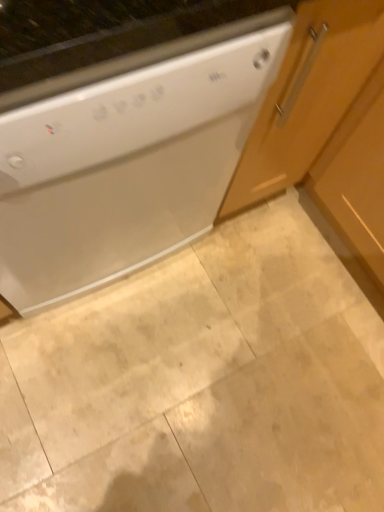
This screenshot has height=512, width=384. What do you see at coordinates (126, 157) in the screenshot? I see `white glossy dishwasher at upper left` at bounding box center [126, 157].

You are a GUI agent. You are given a task and a screenshot of the screen. Output one action in this format:
    pyautogui.click(x=<x>, y=<y>)
    Task: Click on the white glossy dishwasher at upper left
    This screenshot has width=384, height=512.
    Given the screenshot: What is the action you would take?
    pyautogui.click(x=126, y=157)

The width and height of the screenshot is (384, 512). I want to click on beige marble floor at center, so click(202, 383).

Which object is wider, beige marble floor at center or white glossy dishwasher at upper left?

With larger width is beige marble floor at center.

From a real-world perspective, does beige marble floor at center stand above white glossy dishwasher at upper left?

No, from a real-world perspective, beige marble floor at center is not on top of white glossy dishwasher at upper left.

Is beige marble floor at center with white glossy dishwasher at upper left?

No, beige marble floor at center is not touching white glossy dishwasher at upper left.

Looking at this image, in terms of size, does beige marble floor at center appear bigger or smaller than white glossy dishwasher at upper left?

In the image, beige marble floor at center appears to be smaller than white glossy dishwasher at upper left.

From the picture: Considering the relative positions of wooden cabinet at right and white glossy dishwasher at upper left in the image provided, is wooden cabinet at right to the left of white glossy dishwasher at upper left from the viewer's perspective?

In fact, wooden cabinet at right is to the right of white glossy dishwasher at upper left.

Considering the relative sizes of wooden cabinet at right and white glossy dishwasher at upper left in the image provided, is wooden cabinet at right shorter than white glossy dishwasher at upper left?

Indeed, wooden cabinet at right has a lesser height compared to white glossy dishwasher at upper left.

Looking at this image, could you tell me if wooden cabinet at right is turned towards white glossy dishwasher at upper left?

Yes, wooden cabinet at right is facing white glossy dishwasher at upper left.

Is wooden cabinet at right not close to white glossy dishwasher at upper left?

No, wooden cabinet at right is not far from white glossy dishwasher at upper left.

From a real-world perspective, who is located lower, wooden cabinet at right or beige marble floor at center?

beige marble floor at center, from a real-world perspective.

Based on the photo, is wooden cabinet at right taller or shorter than beige marble floor at center?

Clearly, wooden cabinet at right is taller compared to beige marble floor at center.

Is point (251, 181) positioned after point (7, 403)?

That is True.

In the image, is wooden cabinet at right positioned in front of or behind beige marble floor at center?

Clearly, wooden cabinet at right is in front of beige marble floor at center.

Which of these two, beige marble floor at center or wooden cabinet at right, stands shorter?

With less height is beige marble floor at center.

Between point (343, 308) and point (299, 99), which one is positioned in front?

Positioned in front is point (299, 99).

Which object is further away from the camera taking this photo, beige marble floor at center or wooden cabinet at right?

beige marble floor at center is behind.

Would you say beige marble floor at center is a long distance from wooden cabinet at right?

They are positioned close to each other.

Is white glossy dishwasher at upper left directly adjacent to beige marble floor at center?

There is a gap between white glossy dishwasher at upper left and beige marble floor at center.

Is white glossy dishwasher at upper left taller or shorter than beige marble floor at center?

Considering their sizes, white glossy dishwasher at upper left has more height than beige marble floor at center.

Which is behind, white glossy dishwasher at upper left or beige marble floor at center?

beige marble floor at center is behind.

Does point (216, 162) come closer to viewer compared to point (88, 392)?

Yes, point (216, 162) is closer to viewer.

Is white glossy dishwasher at upper left far away from wooden cabinet at right?

No, white glossy dishwasher at upper left is in close proximity to wooden cabinet at right.

Is white glossy dishwasher at upper left facing away from wooden cabinet at right?

No, white glossy dishwasher at upper left's orientation is not away from wooden cabinet at right.

Is point (204, 201) closer to camera compared to point (325, 136)?

Yes, point (204, 201) is in front of point (325, 136).

Is white glossy dishwasher at upper left not inside wooden cabinet at right?

Yes, white glossy dishwasher at upper left is located beyond the bounds of wooden cabinet at right.

Find the location of a particular element. This screenshot has height=512, width=384. granite behind the white glossy dishwasher at upper left is located at coordinates (202, 383).

The width and height of the screenshot is (384, 512). Identify the location of cabinetry above the white glossy dishwasher at upper left (from the image's perspective). (307, 96).

Estimate the real-world distances between objects in this image. Which object is closer to white glossy dishwasher at upper left, wooden cabinet at right or beige marble floor at center?

Among the two, wooden cabinet at right is located nearer to white glossy dishwasher at upper left.

From the image, which object appears to be nearer to beige marble floor at center, white glossy dishwasher at upper left or wooden cabinet at right?

Among the two, white glossy dishwasher at upper left is located nearer to beige marble floor at center.

When comparing their distances from white glossy dishwasher at upper left, does beige marble floor at center or wooden cabinet at right seem closer?

Based on the image, wooden cabinet at right appears to be nearer to white glossy dishwasher at upper left.

From the image, which object appears to be nearer to wooden cabinet at right, white glossy dishwasher at upper left or beige marble floor at center?

white glossy dishwasher at upper left is closer to wooden cabinet at right.

Based on their spatial positions, is wooden cabinet at right or white glossy dishwasher at upper left further from beige marble floor at center?

wooden cabinet at right.

Based on their spatial positions, is beige marble floor at center or white glossy dishwasher at upper left further from wooden cabinet at right?

Based on the image, beige marble floor at center appears to be further to wooden cabinet at right.

Find the location of a particular element. The image size is (384, 512). granite situated between white glossy dishwasher at upper left and wooden cabinet at right from left to right is located at coordinates (202, 383).